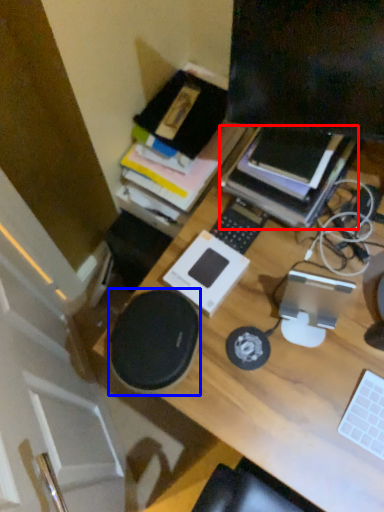
Question: Which object appears closest to the camera in this image, paperback book (highlighted by a red box) or speaker (highlighted by a blue box)?

Choices:
 (A) paperback book
 (B) speaker

Answer: (B)